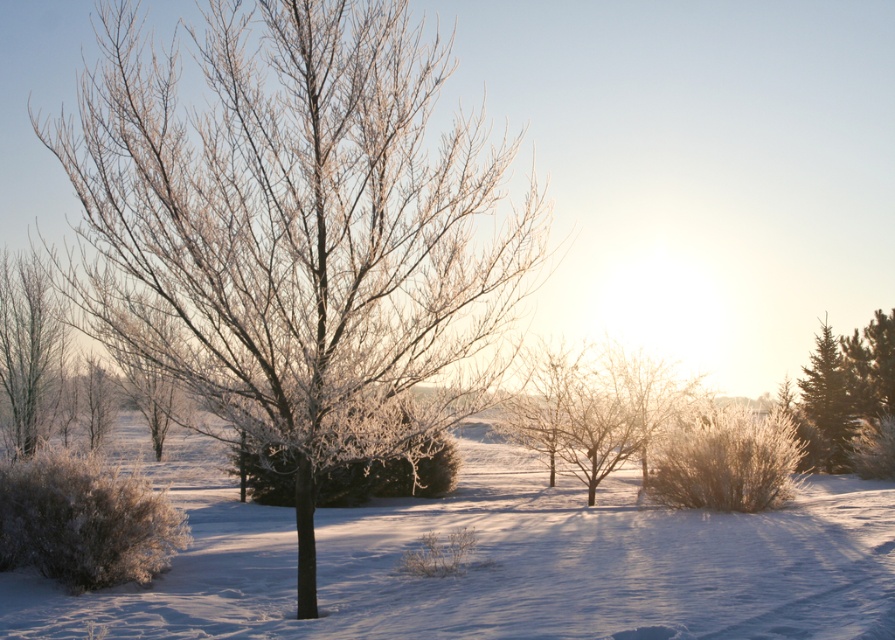
You are standing at the point marked as point (296, 230) in the winter landscape. What object is located exactly at this point?

The point (296, 230) marks the location of the frosted bark tree at center.

You are a photographer planning to take a photo of both the frosted bark tree at center and the frosted white tree at left. Your camera can capture objects within a 5 meter range. Will both trees fit in the photo if you position yourself exactly in the middle between them?

The frosted bark tree at center is 6.27 meters from the frosted white tree at left. If you stand exactly in the middle, the distance from you to each tree would be half of 6.27 meters, which is approximately 3.135 meters. Since this distance is within the camera range of 5 meters, both trees will fit in the photo.

You are an artist sketching this winter scene. You want to ensure the proportions between the frosted bark tree at center and the green textured evergreen at right are accurate. Which tree should you draw taller?

The frosted bark tree at center should be drawn taller than the green textured evergreen at right because it has a greater height compared to it according to the description.